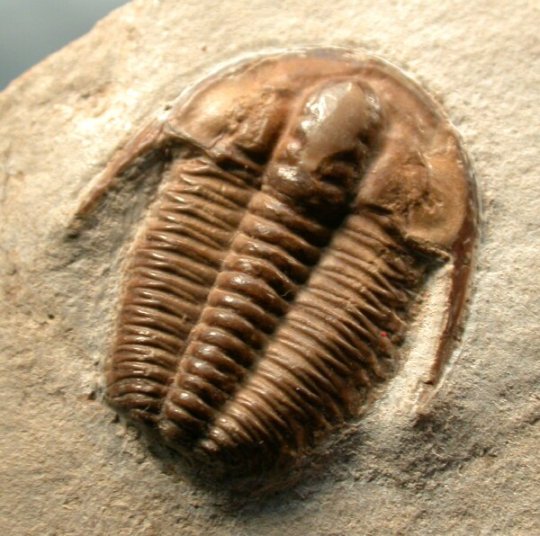
This screenshot has width=540, height=536. What are the coordinates of `corner` in the screenshot? It's located at (438, 31).